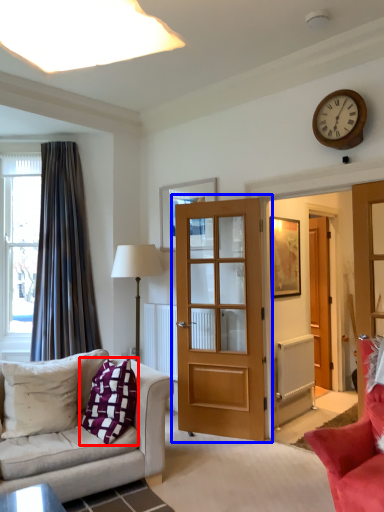
Question: Which point is further to the camera, pillow (highlighted by a red box) or door (highlighted by a blue box)?

Choices:
 (A) pillow
 (B) door

Answer: (B)